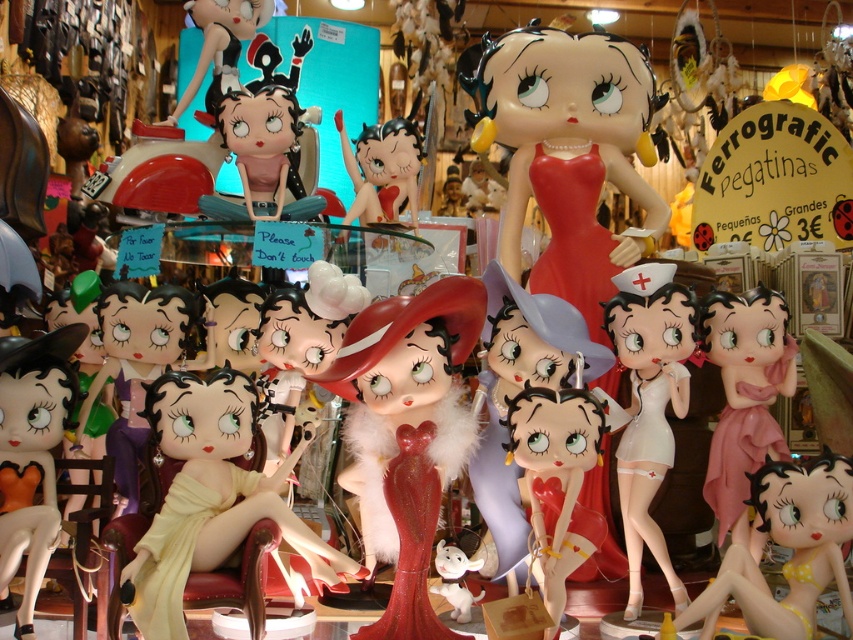
In the scene shown: You are a customer in the store looking at the Betty Boop figurines. You see the pink glossy figurine at center. Can you tell me its exact position in the scene?

The pink glossy figurine at center is located at point (746, 400).

You are a customer in the store looking at the Betty Boop figurines. You see the shiny red dress at center and the pink glossy figurine at center. Which one is positioned more to the left side?

The shiny red dress at center is positioned to the left of the pink glossy figurine at center, so it is more to the left side.